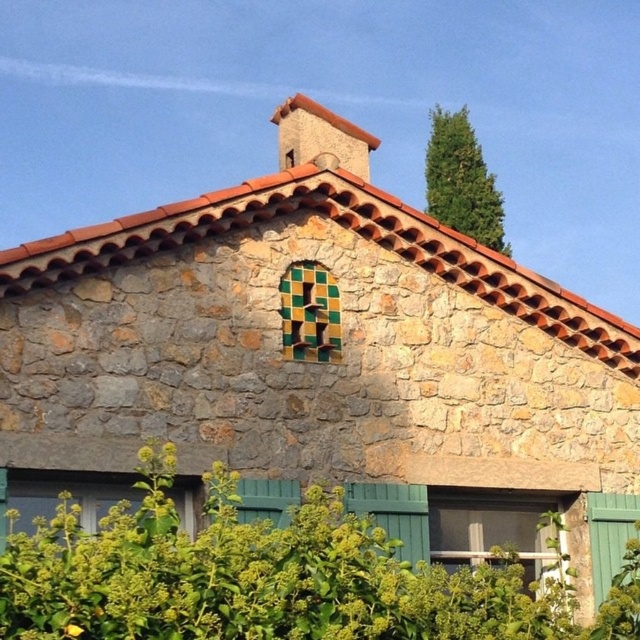
Question: Based on their relative distances, which object is nearer to the green mosaic tiles at center?

Choices:
 (A) matte white window at lower left
 (B) clear glass window at lower center

Answer: (A)

Question: Can you confirm if green leafy hedge at lower center is positioned to the right of green mosaic tiles at center?

Choices:
 (A) no
 (B) yes

Answer: (B)

Question: Does green leafy tree at upper right have a greater width compared to rustic stone chimney at upper center?

Choices:
 (A) no
 (B) yes

Answer: (B)

Question: Based on their relative distances, which object is nearer to the matte white window at lower left?

Choices:
 (A) green leafy tree at upper right
 (B) green mosaic tiles at center
 (C) rustic stone chimney at upper center
 (D) green leafy hedge at lower center

Answer: (B)

Question: Does brown clay tile roof at upper center have a larger size compared to matte white window at lower left?

Choices:
 (A) no
 (B) yes

Answer: (B)

Question: Which point is farther to the camera?

Choices:
 (A) green mosaic tiles at center
 (B) brown clay tile roof at upper center
 (C) rustic stone chimney at upper center

Answer: (C)